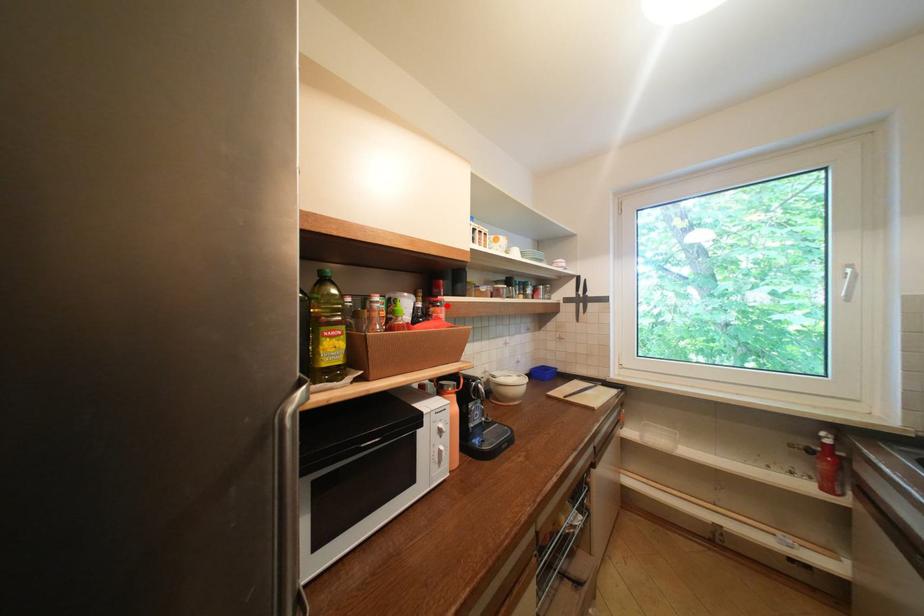
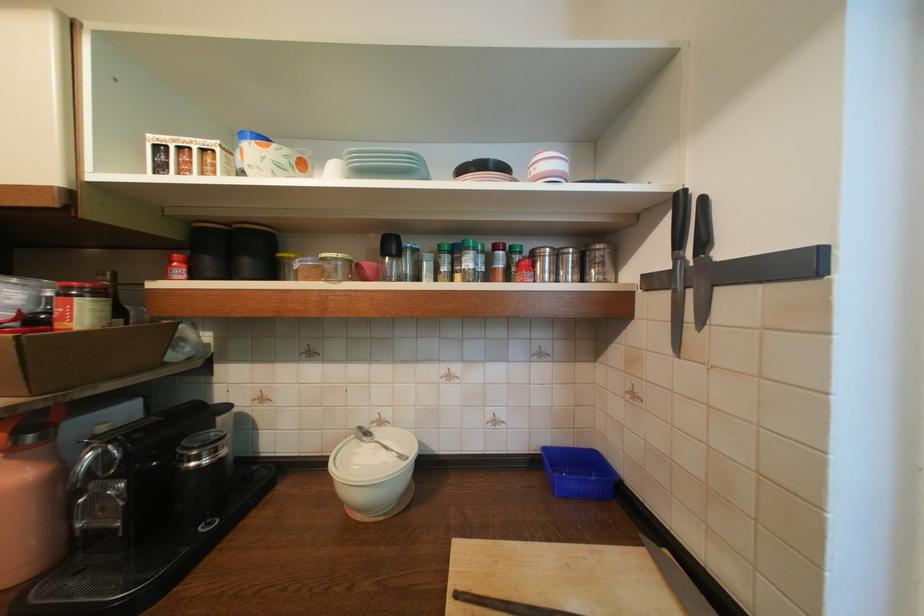
Where in the second image is the point corresponding to the highlighted location from the first image?

(82, 294)